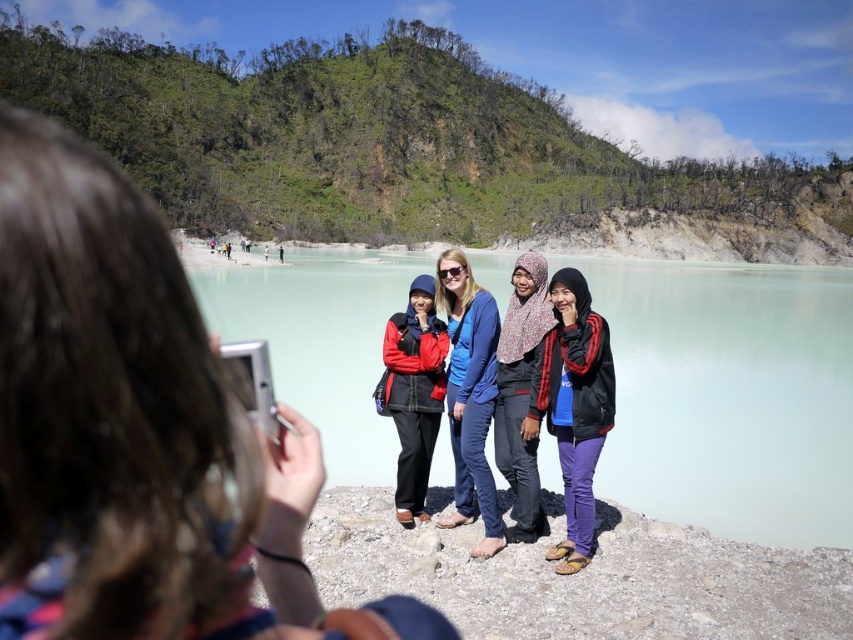
You are the photographer standing in the scene. You want to take a photo of the group without any obstructions. Since the light blue water at center and the blue cotton jacket at center are both in the frame, which one should you adjust to avoid covering the other?

The light blue water at center is above the blue cotton jacket at center. To avoid covering the jacket, you should lower the camera angle slightly so the water doesn

You are standing in the scene and want to take a photo of the light blue water at center and the blue cotton jacket at center. Which object is located to the right of the other?

The light blue water at center is positioned on the right side of blue cotton jacket at center.